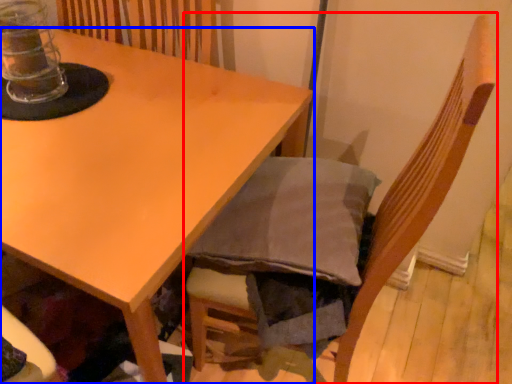
Question: Which object is closer to the camera taking this photo, chair (highlighted by a red box) or table (highlighted by a blue box)?

Choices:
 (A) chair
 (B) table

Answer: (A)